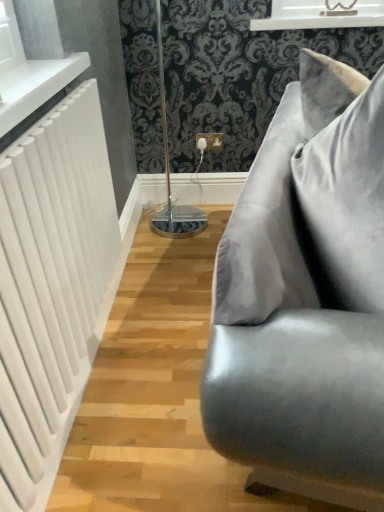
The width and height of the screenshot is (384, 512). What are the coordinates of `blank space above white glossy radiator at upper left (from a real-world perspective)` in the screenshot? It's located at (29, 74).